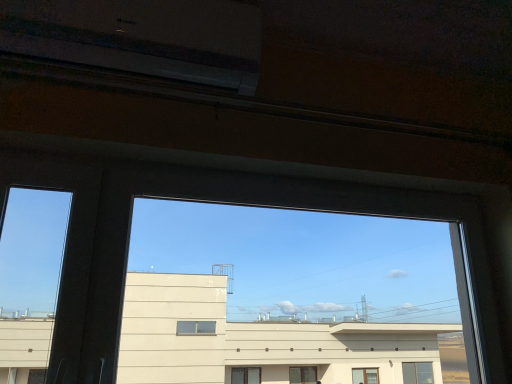
Question: Is transparent glass window at center positioned with its back to white plastic air conditioning unit at upper left?

Choices:
 (A) no
 (B) yes

Answer: (A)

Question: Is transparent glass window at center outside of white plastic air conditioning unit at upper left?

Choices:
 (A) yes
 (B) no

Answer: (A)

Question: Would you say transparent glass window at center contains white plastic air conditioning unit at upper left?

Choices:
 (A) no
 (B) yes

Answer: (A)

Question: Does transparent glass window at center lie behind white plastic air conditioning unit at upper left?

Choices:
 (A) no
 (B) yes

Answer: (A)

Question: Does transparent glass window at center have a smaller size compared to white plastic air conditioning unit at upper left?

Choices:
 (A) no
 (B) yes

Answer: (A)

Question: Is transparent glass window at center to the left of white plastic air conditioning unit at upper left from the viewer's perspective?

Choices:
 (A) no
 (B) yes

Answer: (A)

Question: Is white plastic air conditioning unit at upper left outside of transparent glass window at center?

Choices:
 (A) no
 (B) yes

Answer: (B)

Question: Is white plastic air conditioning unit at upper left positioned behind transparent glass window at center?

Choices:
 (A) yes
 (B) no

Answer: (A)

Question: Is there a large distance between white plastic air conditioning unit at upper left and transparent glass window at center?

Choices:
 (A) no
 (B) yes

Answer: (B)

Question: Does white plastic air conditioning unit at upper left have a lesser width compared to transparent glass window at center?

Choices:
 (A) no
 (B) yes

Answer: (A)

Question: Considering the relative positions of white plastic air conditioning unit at upper left and transparent glass window at center in the image provided, is white plastic air conditioning unit at upper left to the right of transparent glass window at center from the viewer's perspective?

Choices:
 (A) no
 (B) yes

Answer: (A)

Question: From a real-world perspective, is white plastic air conditioning unit at upper left positioned over transparent glass window at center based on gravity?

Choices:
 (A) yes
 (B) no

Answer: (A)

Question: Considering the positions of white plastic air conditioning unit at upper left and transparent glass window at center in the image, is white plastic air conditioning unit at upper left taller or shorter than transparent glass window at center?

Choices:
 (A) short
 (B) tall

Answer: (A)